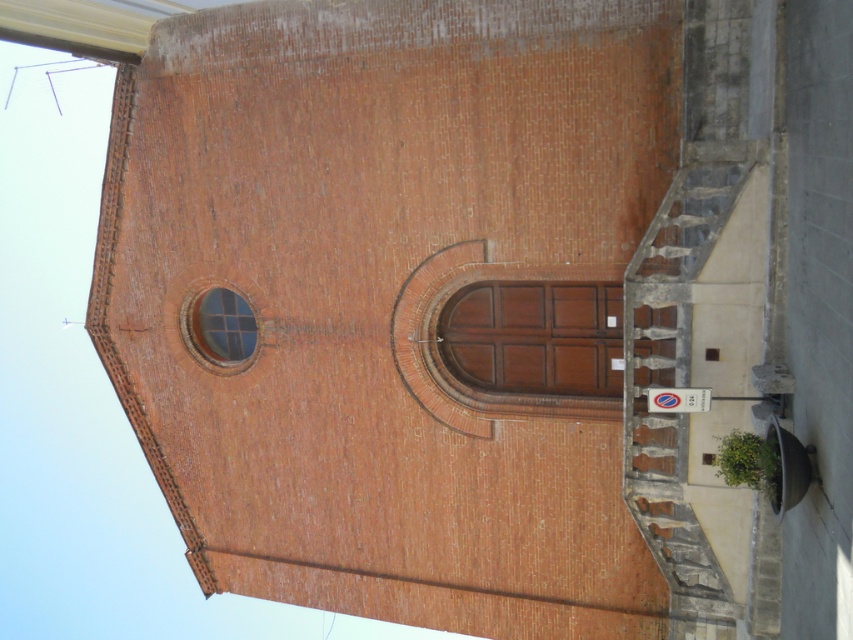
You are standing in front of the brick building and want to enter through the matte brown door at center. Based on the coordinates provided in the Objects Description, can you determine the door is positioned higher or lower than the base of the building?

The matte brown door at center is located at point (534, 337), which means it is positioned higher than the base of the building since the y coordinate is above 0.5, indicating it is more than halfway up the building vertically.

You are a painter who needs to decide which object to paint first between the matte brown door at center and the clear glass window at upper left. If you want to paint the wider object first, which one should you choose?

The matte brown door at center is wider than the clear glass window at upper left, so you should paint the matte brown door at center first.